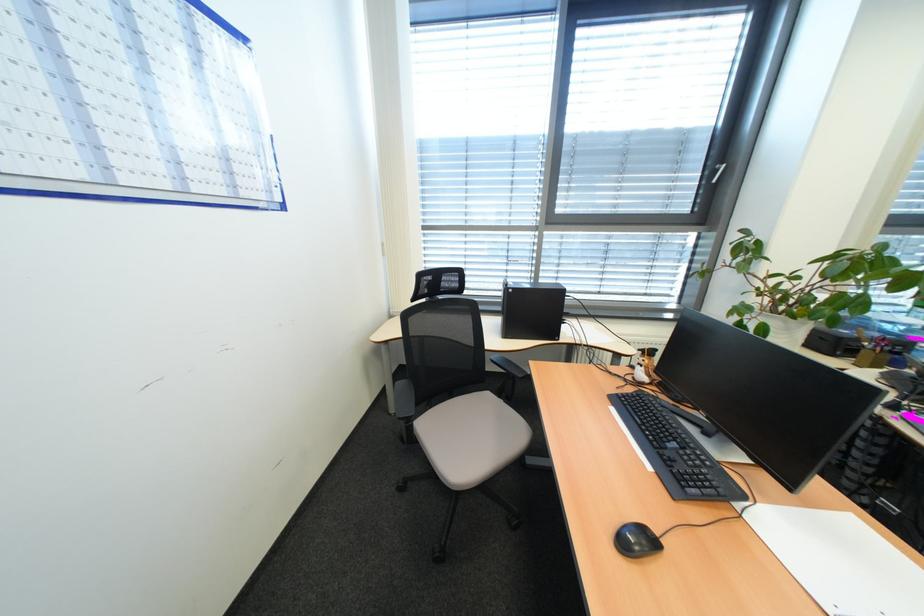
I want to click on white plant pot, so click(x=784, y=323).